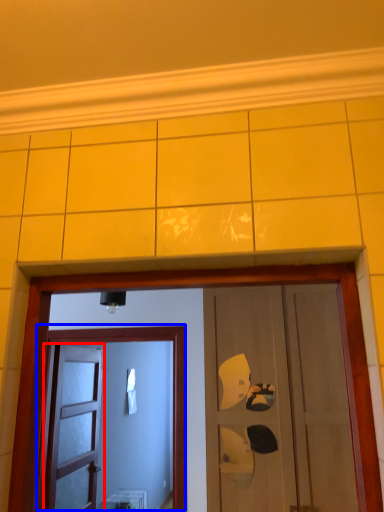
Question: Which point is closer to the camera, door (highlighted by a red box) or door (highlighted by a blue box)?

Choices:
 (A) door
 (B) door

Answer: (B)